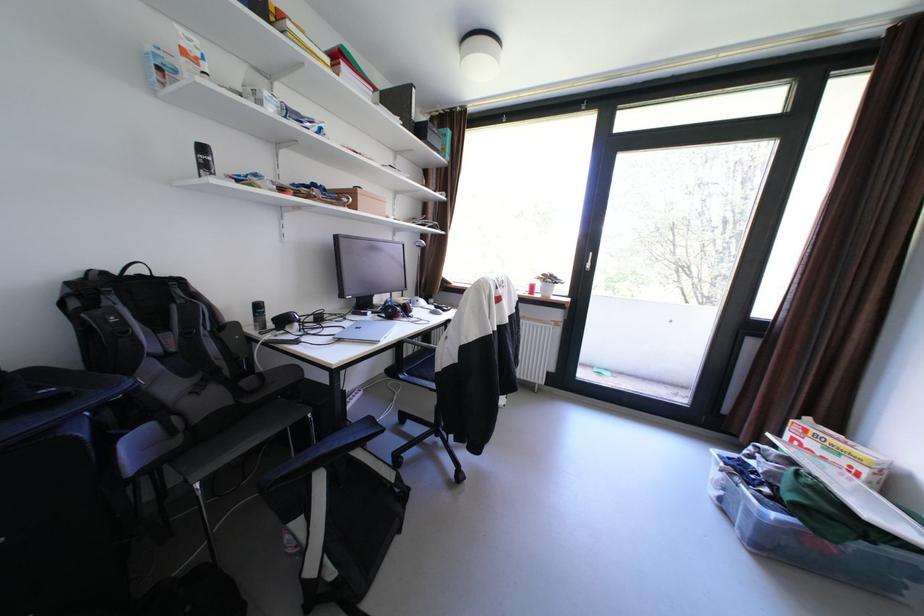
Describe the element at coordinates (420, 363) in the screenshot. This screenshot has height=616, width=924. I see `the chair sitting surface` at that location.